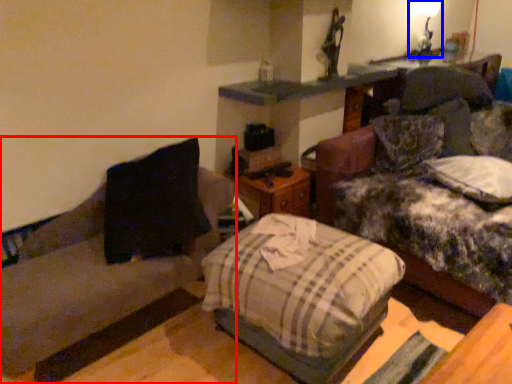
Question: Which object appears farthest to the camera in this image, studio couch (highlighted by a red box) or light fixture (highlighted by a blue box)?

Choices:
 (A) studio couch
 (B) light fixture

Answer: (B)